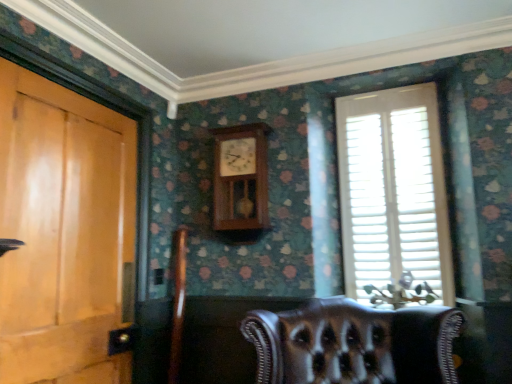
Image resolution: width=512 pixels, height=384 pixels. I want to click on white wood blinds at right, so coord(393,191).

This screenshot has width=512, height=384. Describe the element at coordinates (63, 231) in the screenshot. I see `light brown wood door at left` at that location.

Image resolution: width=512 pixels, height=384 pixels. In order to click on white wood blinds at right in this screenshot , I will do `click(393, 191)`.

At what (x,y) coordinates should I click in order to perform the action: click on window located on the right of leather chair at lower center. Please return your answer as a coordinate pair (x, y). The image size is (512, 384). Looking at the image, I should click on (393, 191).

Considering the relative sizes of white wood blinds at right and leather chair at lower center in the image provided, is white wood blinds at right taller than leather chair at lower center?

Indeed, white wood blinds at right has a greater height compared to leather chair at lower center.

What's the angular difference between white wood blinds at right and leather chair at lower center's facing directions?

The angular difference between white wood blinds at right and leather chair at lower center is 28.1 degrees.

Would you say white wood blinds at right is outside leather chair at lower center?

Yes.

Is white wood blinds at right aimed at wooden clock at center?

No, white wood blinds at right is not turned towards wooden clock at center.

Does white wood blinds at right touch wooden clock at center?

No, white wood blinds at right is not making contact with wooden clock at center.

Find the location of a particular element. The image size is (512, 384). clock that appears above the white wood blinds at right (from the image's perspective) is located at coordinates (241, 177).

Is light brown wood door at left at the back of white wood blinds at right?

No, light brown wood door at left is not at the back of white wood blinds at right.

From the image's perspective, is white wood blinds at right located beneath light brown wood door at left?

No.

Does white wood blinds at right have a greater width compared to light brown wood door at left?

No, white wood blinds at right is not wider than light brown wood door at left.

Between light brown wood door at left and wooden clock at center, which one has larger size?

Bigger between the two is light brown wood door at left.

From the image's perspective, which object appears higher, light brown wood door at left or wooden clock at center?

From the image's view, wooden clock at center is above.

From a real-world perspective, is light brown wood door at left physically located above or below wooden clock at center?

Clearly, from a real-world perspective, light brown wood door at left is below wooden clock at center.

Looking at this image, is leather chair at lower center located outside white wood blinds at right?

Yes.

At what (x,y) coordinates should I click in order to perform the action: click on window on the right side of leather chair at lower center. Please return your answer as a coordinate pair (x, y). The height and width of the screenshot is (384, 512). Looking at the image, I should click on (393, 191).

Which object is further away from the camera, leather chair at lower center or white wood blinds at right?

white wood blinds at right.

Visually, is wooden clock at center positioned to the left or to the right of leather chair at lower center?

From the image, it's evident that wooden clock at center is to the left of leather chair at lower center.

Looking at this image, is wooden clock at center facing towards leather chair at lower center?

No, wooden clock at center is not oriented towards leather chair at lower center.

Is leather chair at lower center thinner than light brown wood door at left?

No.

Consider the image. Can you confirm if leather chair at lower center is taller than light brown wood door at left?

No.

Are leather chair at lower center and light brown wood door at left making contact?

No, leather chair at lower center is not making contact with light brown wood door at left.

The width and height of the screenshot is (512, 384). What are the coordinates of `door above the leather chair at lower center (from the image's perspective)` in the screenshot? It's located at (63, 231).

The image size is (512, 384). I want to click on chair that appears below the white wood blinds at right (from the image's perspective), so click(x=353, y=344).

At what (x,y) coordinates should I click in order to perform the action: click on window that appears on the right of wooden clock at center. Please return your answer as a coordinate pair (x, y). Looking at the image, I should click on (393, 191).

Estimate the real-world distances between objects in this image. Which object is closer to wooden clock at center, white wood blinds at right or light brown wood door at left?

Based on the image, white wood blinds at right appears to be nearer to wooden clock at center.

When comparing their distances from light brown wood door at left, does wooden clock at center or leather chair at lower center seem closer?

wooden clock at center.

Based on their spatial positions, is leather chair at lower center or wooden clock at center further from light brown wood door at left?

leather chair at lower center is positioned further to the anchor light brown wood door at left.

From the image, which object appears to be nearer to light brown wood door at left, leather chair at lower center or white wood blinds at right?

leather chair at lower center is closer to light brown wood door at left.

Based on their spatial positions, is light brown wood door at left or wooden clock at center further from white wood blinds at right?

light brown wood door at left is further to white wood blinds at right.

Looking at this image, from the image, which object appears to be nearer to white wood blinds at right, leather chair at lower center or light brown wood door at left?

Among the two, leather chair at lower center is located nearer to white wood blinds at right.

In the scene shown: Estimate the real-world distances between objects in this image. Which object is closer to wooden clock at center, light brown wood door at left or leather chair at lower center?

light brown wood door at left is positioned closer to the anchor wooden clock at center.

Considering their positions, is white wood blinds at right positioned further to light brown wood door at left than wooden clock at center?

Among the two, white wood blinds at right is located further to light brown wood door at left.

Image resolution: width=512 pixels, height=384 pixels. Find the location of `clock between light brown wood door at left and white wood blinds at right in the horizontal direction`. clock between light brown wood door at left and white wood blinds at right in the horizontal direction is located at coordinates (241, 177).

The width and height of the screenshot is (512, 384). I want to click on window positioned between leather chair at lower center and wooden clock at center from near to far, so click(x=393, y=191).

Where is `door between leather chair at lower center and wooden clock at center in the front-back direction`? The width and height of the screenshot is (512, 384). door between leather chair at lower center and wooden clock at center in the front-back direction is located at coordinates (63, 231).

You are a GUI agent. You are given a task and a screenshot of the screen. Output one action in this format:
    pyautogui.click(x=<x>, y=<y>)
    Task: Click on the chair between light brown wood door at left and white wood blinds at right from left to right
    Image resolution: width=512 pixels, height=384 pixels.
    Given the screenshot: What is the action you would take?
    pyautogui.click(x=353, y=344)